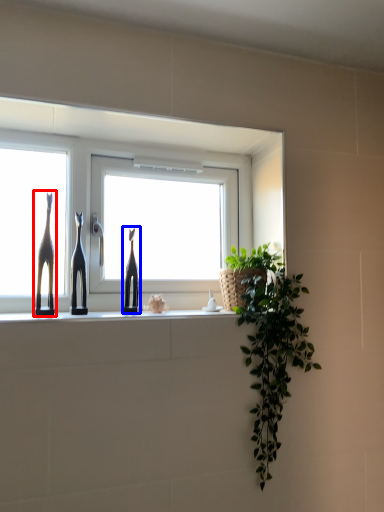
Question: Which of the following is the farthest to the observer, giraffe (highlighted by a red box) or sculpture (highlighted by a blue box)?

Choices:
 (A) giraffe
 (B) sculpture

Answer: (B)